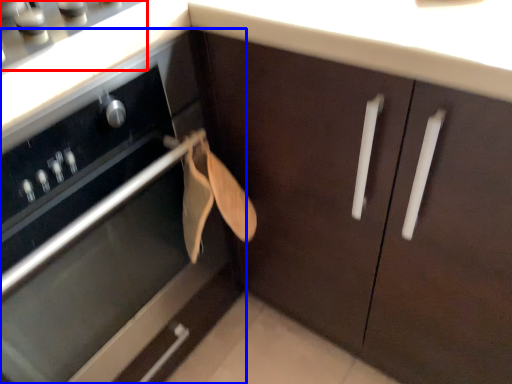
Question: Which point is further to the camera, gas stove (highlighted by a red box) or cabinetry (highlighted by a blue box)?

Choices:
 (A) gas stove
 (B) cabinetry

Answer: (A)